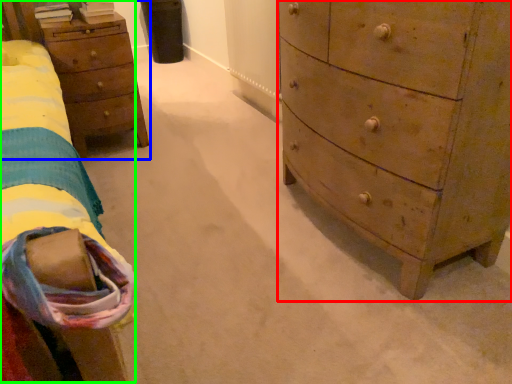
Question: Based on their relative distances, which object is farther from chest of drawers (highlighted by a red box)? Choose from nightstand (highlighted by a blue box) and bed (highlighted by a green box).

Choices:
 (A) nightstand
 (B) bed

Answer: (A)